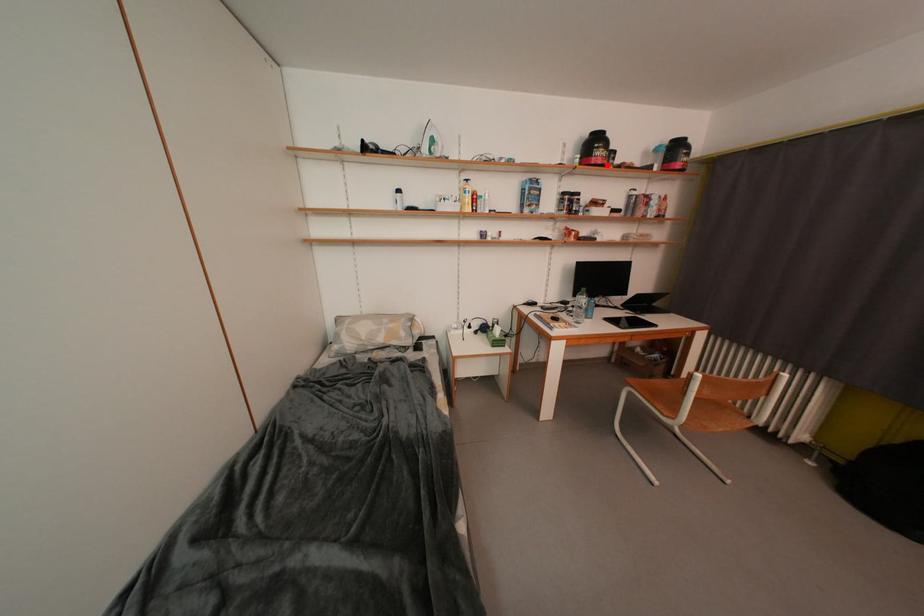
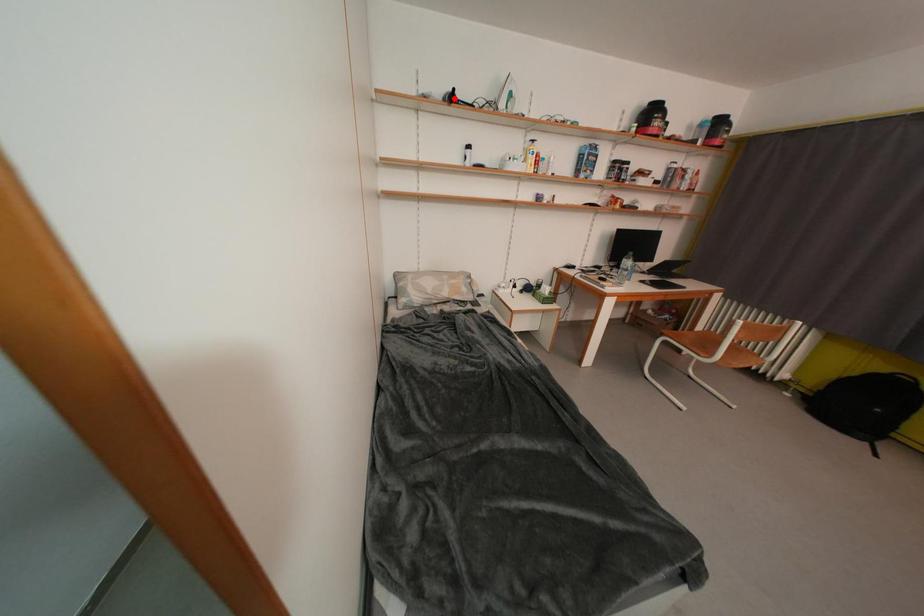
I am providing you with two images of the same scene from different viewpoints. A red point is marked on the first image and another point is marked on the second image. Is the red point in image1 aligned with the point shown in image2?

No